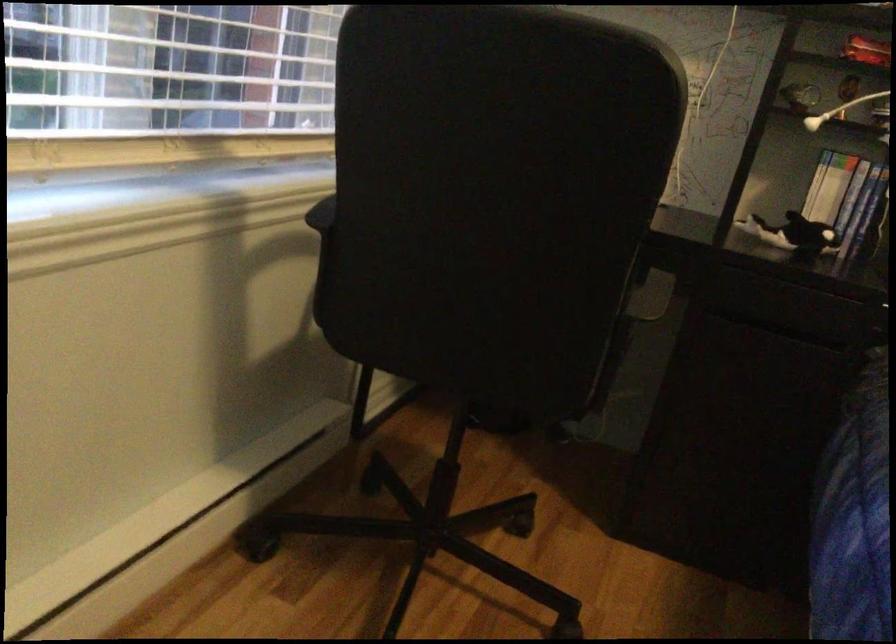
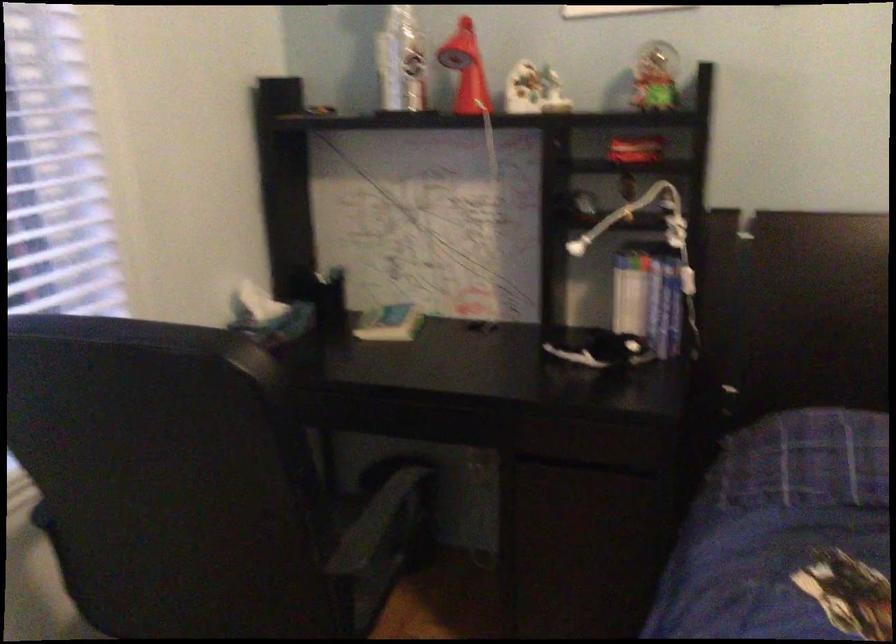
Find the pixel in the second image that matches point (814, 125) in the first image.

(576, 247)